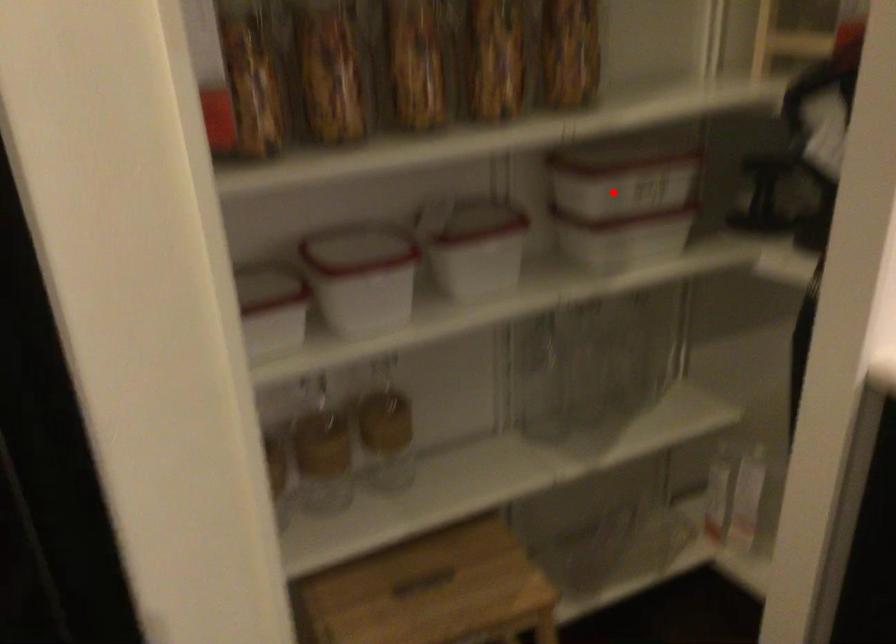
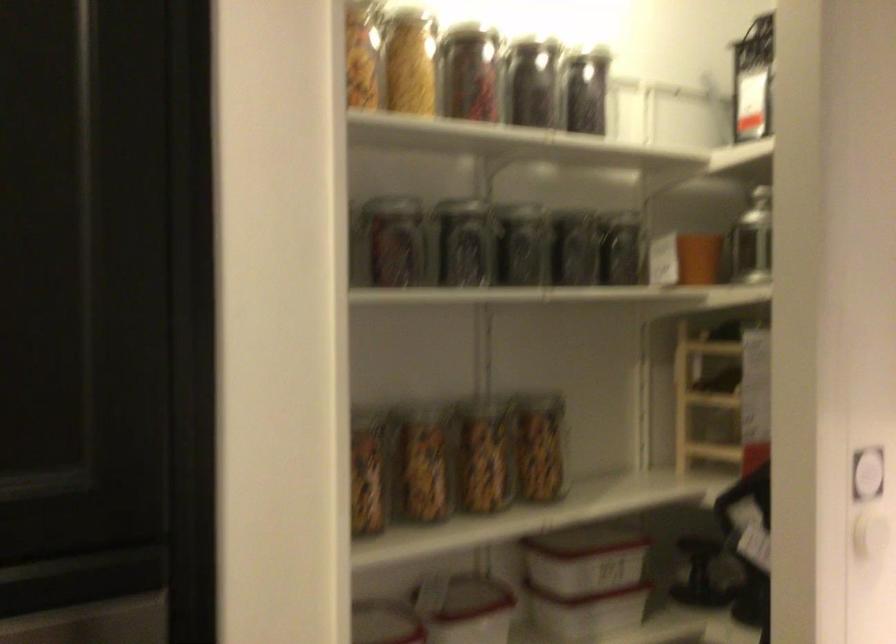
Question: I am providing you with two images of the same scene from different viewpoints. In image1, a red point is highlighted. Considering the same 3D point in image2, which of the following is correct?

Choices:
 (A) It is closer
 (B) It is farther

Answer: (B)